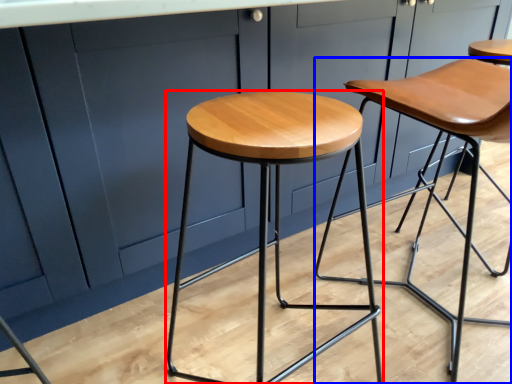
Question: Which object is further to the camera taking this photo, stool (highlighted by a red box) or stool (highlighted by a blue box)?

Choices:
 (A) stool
 (B) stool

Answer: (B)